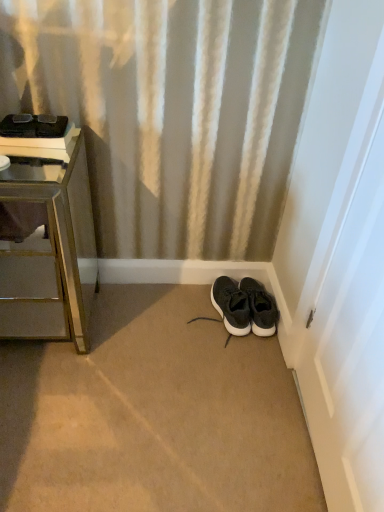
Image resolution: width=384 pixels, height=512 pixels. What are the coordinates of `blank area beneath white glossy door at right (from a real-world perspective)` in the screenshot? It's located at (302, 438).